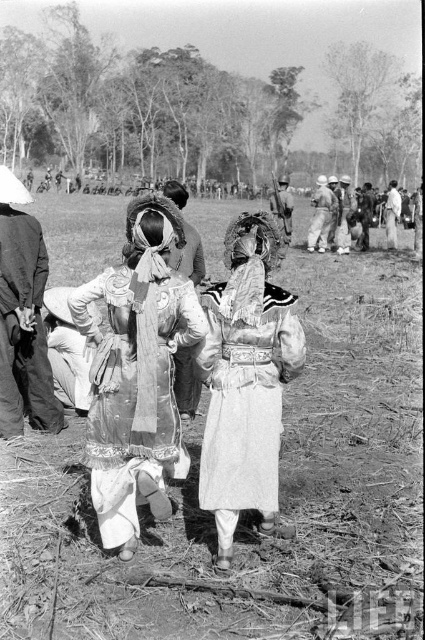
Question: Does dirt field at center lie behind embroidered silk dress at center?

Choices:
 (A) yes
 (B) no

Answer: (B)

Question: Which point is closer to the camera?

Choices:
 (A) (121, 433)
 (B) (161, 564)

Answer: (A)

Question: Which object appears closest to the camera in this image?

Choices:
 (A) embroidered silk dress at center
 (B) white textured dress at center

Answer: (A)

Question: Which point is closer to the camera?

Choices:
 (A) white textured dress at center
 (B) embroidered silk dress at center
 (C) dirt field at center

Answer: (C)

Question: Can you confirm if embroidered silk dress at center is smaller than white textured dress at center?

Choices:
 (A) no
 (B) yes

Answer: (A)

Question: Is dirt field at center behind white textured dress at center?

Choices:
 (A) no
 (B) yes

Answer: (A)